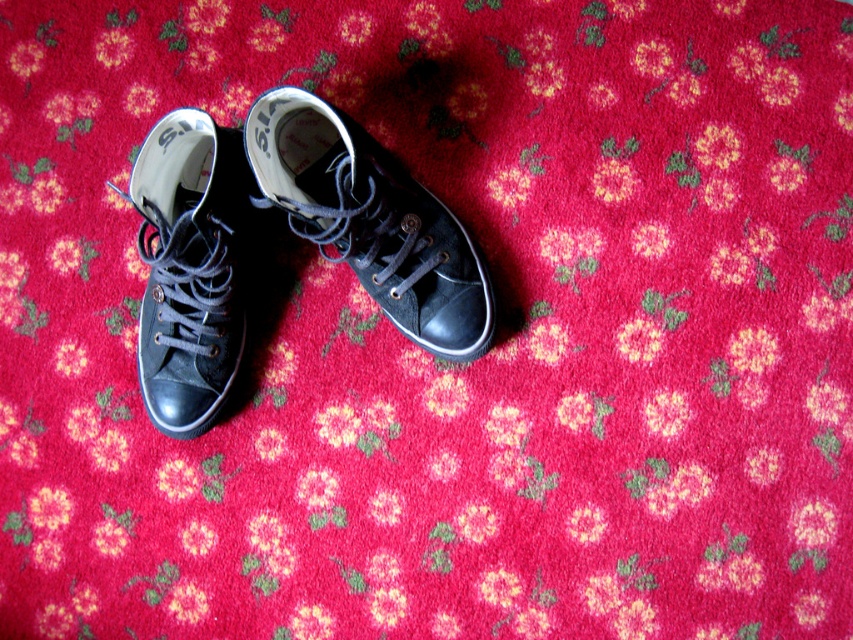
Question: Which point appears closest to the camera in this image?

Choices:
 (A) (224, 371)
 (B) (302, 202)

Answer: (B)

Question: Does matte black sneaker at center have a larger size compared to matte black sneaker at left?

Choices:
 (A) no
 (B) yes

Answer: (B)

Question: From the image, what is the correct spatial relationship of matte black sneaker at center in relation to matte black sneaker at left?

Choices:
 (A) above
 (B) below

Answer: (A)

Question: Which object is farther from the camera taking this photo?

Choices:
 (A) matte black sneaker at left
 (B) matte black sneaker at center

Answer: (A)

Question: Does matte black sneaker at center have a greater width compared to matte black sneaker at left?

Choices:
 (A) no
 (B) yes

Answer: (B)

Question: Which point is farther to the camera?

Choices:
 (A) (178, 244)
 (B) (254, 138)

Answer: (A)